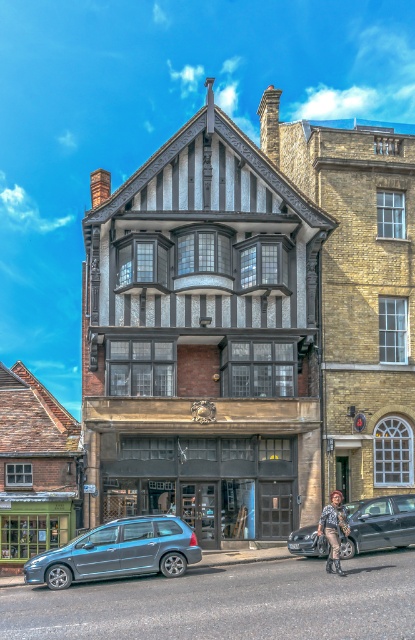
Question: Which of the following is the farthest from the observer?

Choices:
 (A) leather jacket at lower right
 (B) shiny black car at lower right

Answer: (B)

Question: Is the position of shiny black car at lower right more distant than that of leather jacket at lower right?

Choices:
 (A) yes
 (B) no

Answer: (A)

Question: Is metallic blue minivan at lower left above leather jacket at lower right?

Choices:
 (A) yes
 (B) no

Answer: (B)

Question: Is shiny black car at lower right wider than leather jacket at lower right?

Choices:
 (A) no
 (B) yes

Answer: (B)

Question: Which point appears closest to the camera in this image?

Choices:
 (A) (88, 536)
 (B) (351, 541)

Answer: (A)

Question: Estimate the real-world distances between objects in this image. Which object is farther from the leather jacket at lower right?

Choices:
 (A) metallic blue minivan at lower left
 (B) shiny black car at lower right

Answer: (A)